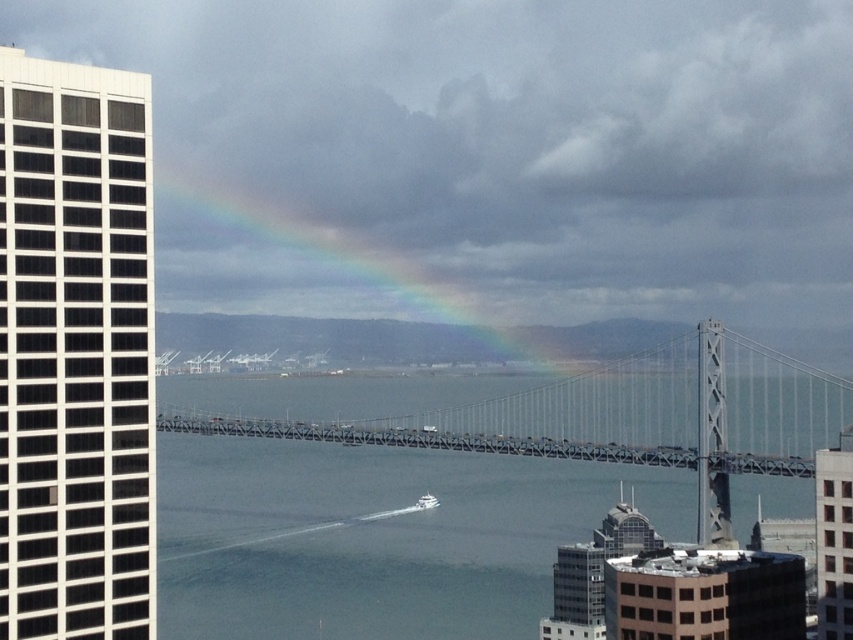
Question: Can you confirm if rainbow at upper center is thinner than white glossy boat at center?

Choices:
 (A) yes
 (B) no

Answer: (B)

Question: Is rainbow at upper center wider than white glossy boat at center?

Choices:
 (A) yes
 (B) no

Answer: (A)

Question: Which object is closer to the camera taking this photo?

Choices:
 (A) white glossy boat at center
 (B) rainbow at upper center

Answer: (B)

Question: Which of the following is the closest to the observer?

Choices:
 (A) (514, 349)
 (B) (430, 496)

Answer: (B)

Question: Can you confirm if rainbow at upper center is bigger than white glossy boat at center?

Choices:
 (A) yes
 (B) no

Answer: (A)